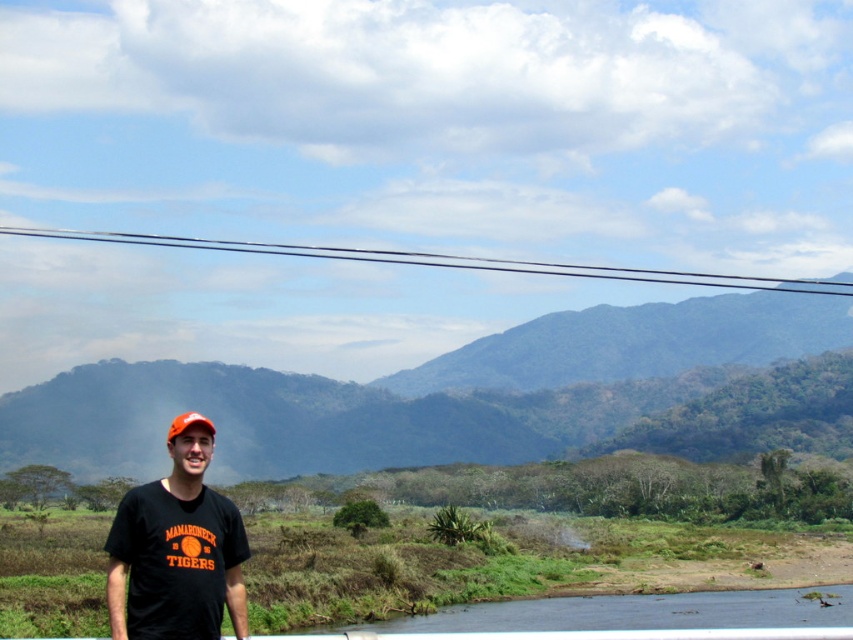
Is point (610, 401) positioned behind point (302, 244)?

No, it is in front of (302, 244).

Who is positioned more to the right, green leafy forest at center or black wire at upper center?

black wire at upper center

Who is more distant from viewer, (x=665, y=371) or (x=590, y=273)?

Point (x=590, y=273)

Locate an element on the screen. green leafy forest at center is located at coordinates (x=421, y=394).

Is black matte t-shirt at lower left further to the viewer compared to orange matte baseball cap at center?

That is False.

Between black matte t-shirt at lower left and orange matte baseball cap at center, which one has less height?

With less height is black matte t-shirt at lower left.

Where is `black matte t-shirt at lower left`? This screenshot has width=853, height=640. black matte t-shirt at lower left is located at coordinates (177, 554).

Does point (619, 400) come in front of point (189, 554)?

No, it is not.

Is point (631, 378) farther from viewer compared to point (193, 564)?

Yes, point (631, 378) is behind point (193, 564).

I want to click on green leafy forest at center, so click(x=421, y=394).

Locate an element on the screen. The height and width of the screenshot is (640, 853). green leafy forest at center is located at coordinates (421, 394).